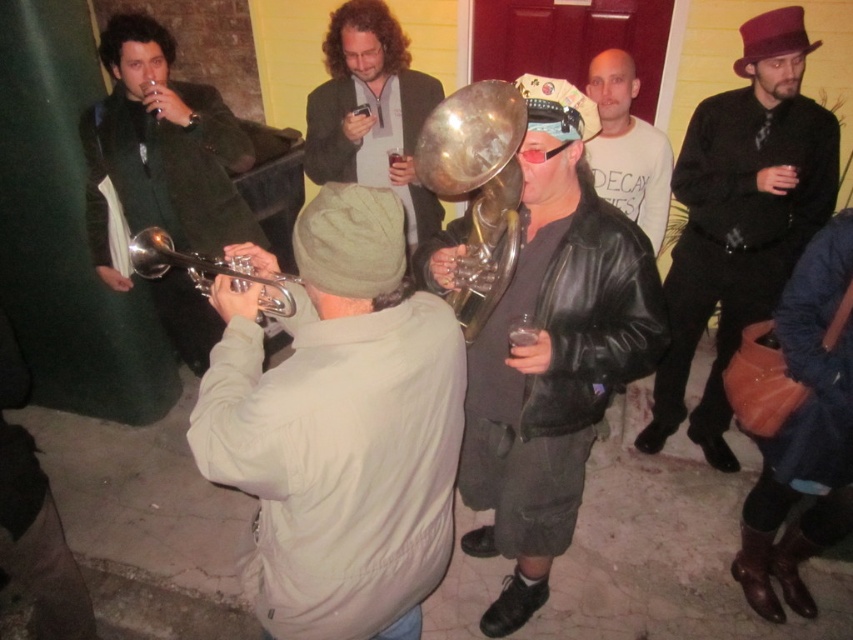
Question: Does shiny silver tuba at center have a greater width compared to shiny brass trumpet at center?

Choices:
 (A) no
 (B) yes

Answer: (B)

Question: In this image, where is shiny silver tuba at center located relative to matte green jacket at left?

Choices:
 (A) below
 (B) above

Answer: (A)

Question: Which point is farther to the camera?

Choices:
 (A) matte black jacket at center
 (B) light beige cotton jacket at center
 (C) white cotton t-shirt at center
 (D) shiny brass trumpet at center

Answer: (C)

Question: Which point appears farthest from the camera in this image?

Choices:
 (A) (531, 332)
 (B) (123, 16)
 (C) (331, 173)
 (D) (138, 241)

Answer: (C)

Question: Can you confirm if shiny silver tuba at center is positioned above matte black jacket at center?

Choices:
 (A) no
 (B) yes

Answer: (A)

Question: Among these points, which one is farthest from the camera?

Choices:
 (A) (381, 179)
 (B) (223, 179)
 (C) (283, 307)

Answer: (A)